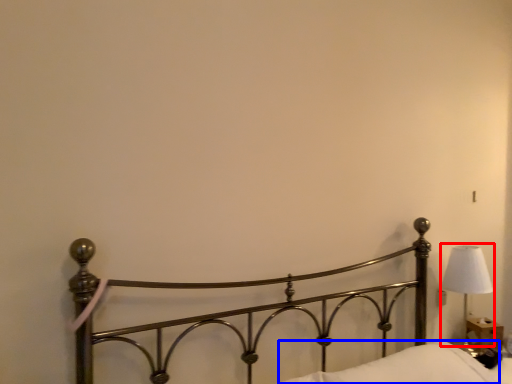
Question: Which object is further to the camera taking this photo, lamp (highlighted by a red box) or pillow (highlighted by a blue box)?

Choices:
 (A) lamp
 (B) pillow

Answer: (A)